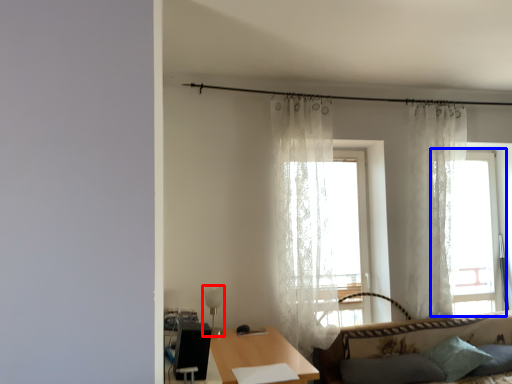
Question: Which object is further to the camera taking this photo, lamp (highlighted by a red box) or window (highlighted by a blue box)?

Choices:
 (A) lamp
 (B) window

Answer: (B)